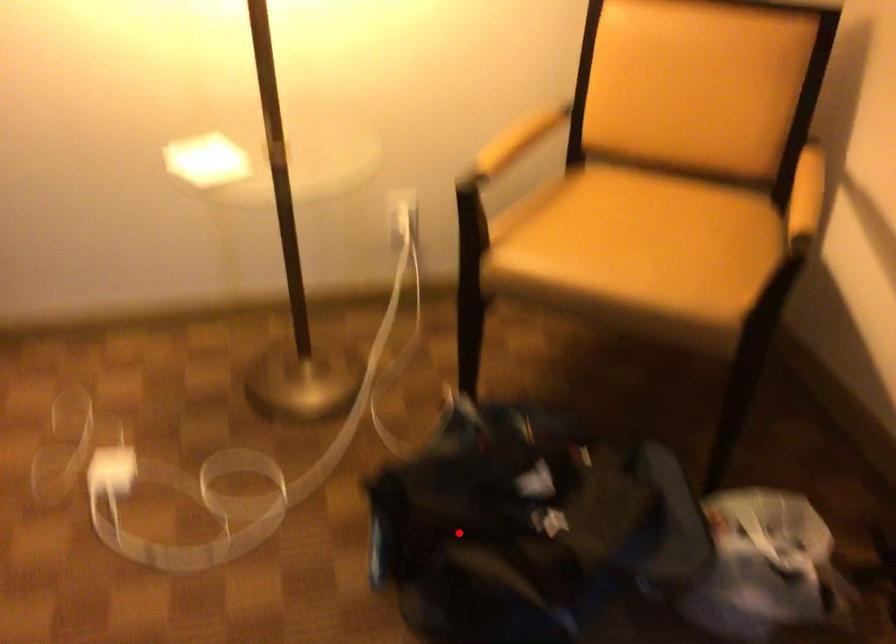
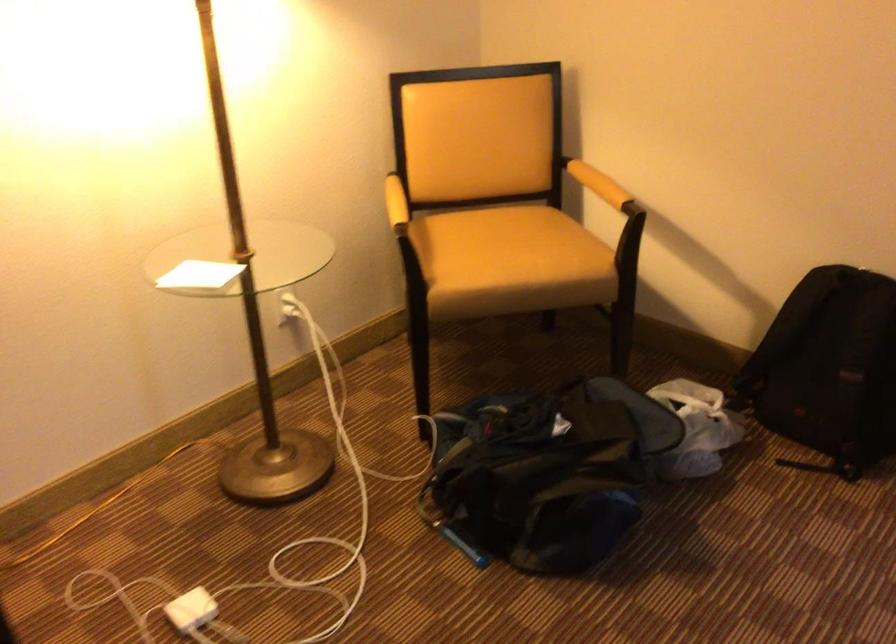
Find the pixel in the second image that matches the highlighted location in the first image.

(537, 480)